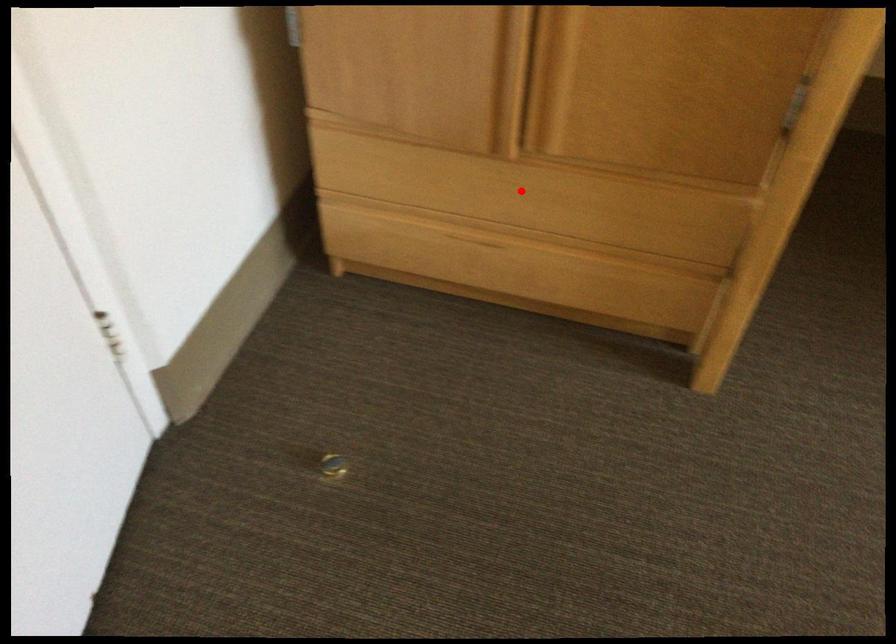
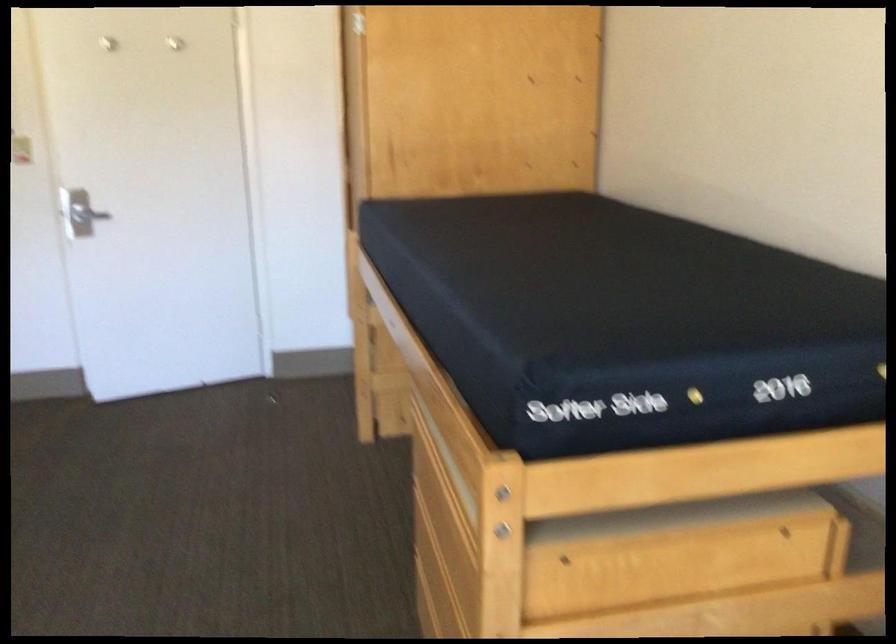
Question: I am providing you with two images of the same scene from different viewpoints. A red point is marked on the first image. Is the red point's position out of view in image 2?

Choices:
 (A) Yes
 (B) No

Answer: (A)